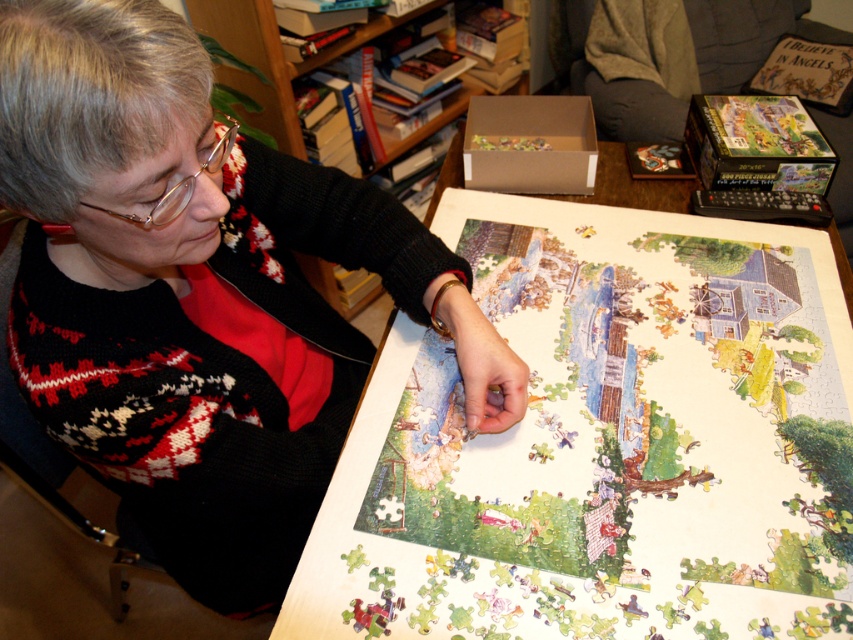
Question: Which point appears closest to the camera in this image?

Choices:
 (A) (329, 170)
 (B) (483, 556)
 (C) (285, 83)

Answer: (B)

Question: Does white wood table at center have a lesser width compared to knitted sweater at center?

Choices:
 (A) no
 (B) yes

Answer: (A)

Question: Can you confirm if white wood table at center is wider than knitted sweater at center?

Choices:
 (A) no
 (B) yes

Answer: (B)

Question: Estimate the real-world distances between objects in this image. Which object is closer to the white wood table at center?

Choices:
 (A) wooden bookshelf at upper center
 (B) knitted sweater at center

Answer: (B)

Question: Does white wood table at center come in front of knitted sweater at center?

Choices:
 (A) no
 (B) yes

Answer: (A)

Question: Which of these objects is positioned farthest from the knitted sweater at center?

Choices:
 (A) wooden bookshelf at upper center
 (B) white wood table at center

Answer: (A)